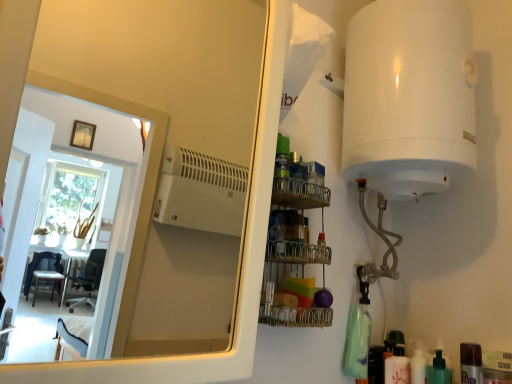
Question: Does white glossy mirror at upper left come in front of white glossy bottle at lower right, the third toiletry from the right?

Choices:
 (A) no
 (B) yes

Answer: (B)

Question: Is white glossy mirror at upper left outside of white glossy bottle at lower right, the third toiletry from the right?

Choices:
 (A) no
 (B) yes

Answer: (B)

Question: From the image's perspective, is white glossy mirror at upper left beneath white glossy bottle at lower right, the second toiletry positioned from the left?

Choices:
 (A) no
 (B) yes

Answer: (A)

Question: Would you say white glossy mirror at upper left is a long distance from white glossy bottle at lower right, the third toiletry from the right?

Choices:
 (A) yes
 (B) no

Answer: (A)

Question: Could you tell me if white glossy mirror at upper left is turned towards white glossy bottle at lower right, the second toiletry positioned from the left?

Choices:
 (A) yes
 (B) no

Answer: (B)

Question: From the image's perspective, would you say white glossy mirror at upper left is positioned over white glossy bottle at lower right, the second toiletry positioned from the left?

Choices:
 (A) yes
 (B) no

Answer: (A)

Question: Is translucent plastic bottle at lower right, the fourth toiletry from the right, wider than white glossy bottle at lower right, the third toiletry from the right?

Choices:
 (A) yes
 (B) no

Answer: (B)

Question: Are translucent plastic bottle at lower right, the fourth toiletry from the right, and white glossy bottle at lower right, the third toiletry from the right, making contact?

Choices:
 (A) yes
 (B) no

Answer: (A)

Question: Could you tell me if translucent plastic bottle at lower right, which appears as the 1th toiletry when viewed from the left, is facing white glossy bottle at lower right, the third toiletry from the right?

Choices:
 (A) no
 (B) yes

Answer: (A)

Question: Does translucent plastic bottle at lower right, which appears as the 1th toiletry when viewed from the left, lie behind white glossy bottle at lower right, the second toiletry positioned from the left?

Choices:
 (A) no
 (B) yes

Answer: (B)

Question: Is translucent plastic bottle at lower right, which appears as the 1th toiletry when viewed from the left, oriented away from white glossy bottle at lower right, the second toiletry positioned from the left?

Choices:
 (A) no
 (B) yes

Answer: (A)

Question: Can you confirm if translucent plastic bottle at lower right, which appears as the 1th toiletry when viewed from the left, is smaller than white glossy bottle at lower right, the second toiletry positioned from the left?

Choices:
 (A) yes
 (B) no

Answer: (B)

Question: From a real-world perspective, is translucent plastic bottle at lower right, which appears as the 1th toiletry when viewed from the left, on top of white glossy mirror at upper left?

Choices:
 (A) yes
 (B) no

Answer: (B)